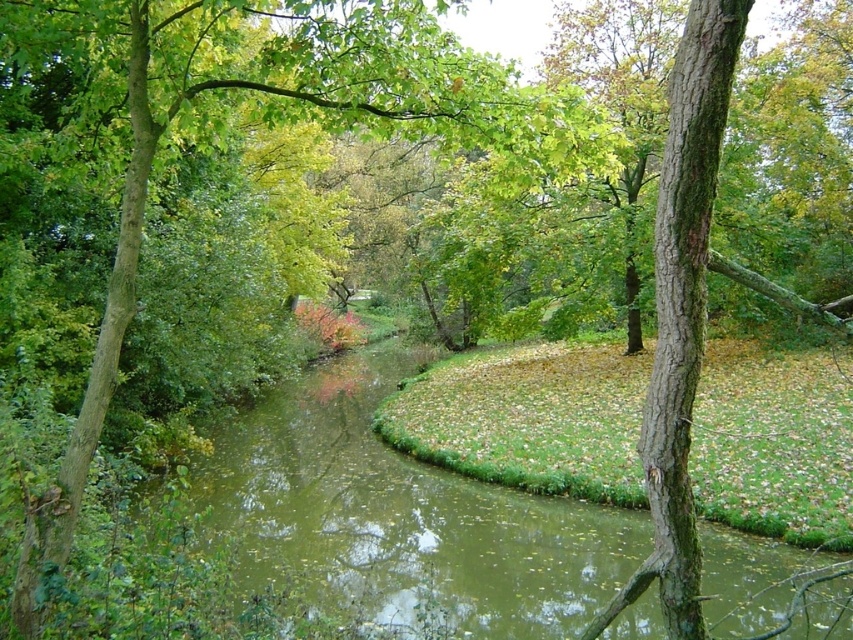
Question: Among these points, which one is nearest to the camera?

Choices:
 (A) (154, 108)
 (B) (360, 376)

Answer: (A)

Question: Does green murky water at center have a smaller size compared to green leafy tree at center?

Choices:
 (A) no
 (B) yes

Answer: (A)

Question: Which point is farther to the camera?

Choices:
 (A) green murky water at center
 (B) green leafy tree at center

Answer: (B)

Question: Which point appears farthest from the camera in this image?

Choices:
 (A) (511, 138)
 (B) (819, 632)

Answer: (B)

Question: Does green murky water at center lie behind green leafy tree at center?

Choices:
 (A) yes
 (B) no

Answer: (B)

Question: Does green murky water at center have a larger size compared to green leafy tree at center?

Choices:
 (A) yes
 (B) no

Answer: (A)